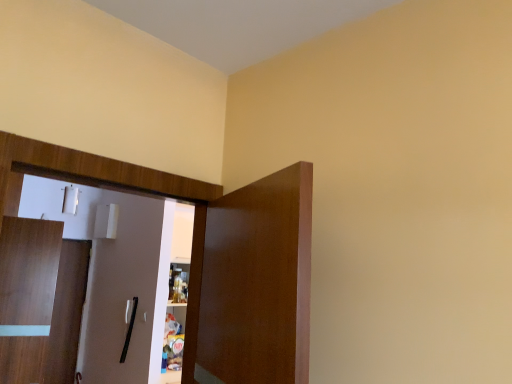
Question: Does wooden door at left, the 2th door when ordered from front to back, lie in front of wooden dresser at left?

Choices:
 (A) no
 (B) yes

Answer: (A)

Question: Can you confirm if wooden door at left, acting as the 1th door starting from the back, is shorter than wooden dresser at left?

Choices:
 (A) no
 (B) yes

Answer: (A)

Question: From a real-world perspective, is wooden door at left, which is the second door in right-to-left order, over wooden dresser at left?

Choices:
 (A) yes
 (B) no

Answer: (B)

Question: From the image's perspective, is wooden door at left, the 2th door when ordered from front to back, below wooden dresser at left?

Choices:
 (A) no
 (B) yes

Answer: (B)

Question: Is the position of wooden door at left, the 2th door when ordered from front to back, more distant than that of wooden dresser at left?

Choices:
 (A) no
 (B) yes

Answer: (B)

Question: Would you say brown wooden door at center, the 1th door viewed from the top, is to the left or to the right of wooden dresser at left in the picture?

Choices:
 (A) right
 (B) left

Answer: (A)

Question: Considering the positions of brown wooden door at center, which is counted as the second door, starting from the back, and wooden dresser at left in the image, is brown wooden door at center, which is counted as the second door, starting from the back, taller or shorter than wooden dresser at left?

Choices:
 (A) tall
 (B) short

Answer: (B)

Question: From a real-world perspective, is brown wooden door at center, acting as the 2th door starting from the left, physically located above or below wooden dresser at left?

Choices:
 (A) below
 (B) above

Answer: (A)

Question: In terms of width, does brown wooden door at center, the first door viewed from the right, look wider or thinner when compared to wooden dresser at left?

Choices:
 (A) wide
 (B) thin

Answer: (A)

Question: Choose the correct answer: Is wooden door at left, which ranks as the 1th door in left-to-right order, inside brown wooden door at center, the first door positioned from the front, or outside it?

Choices:
 (A) inside
 (B) outside

Answer: (B)

Question: Considering the positions of wooden door at left, the 2th door when ordered from front to back, and brown wooden door at center, positioned as the 2th door in bottom-to-top order, in the image, is wooden door at left, the 2th door when ordered from front to back, taller or shorter than brown wooden door at center, positioned as the 2th door in bottom-to-top order,?

Choices:
 (A) short
 (B) tall

Answer: (B)

Question: Considering the positions of wooden door at left, the 2th door when ordered from front to back, and brown wooden door at center, positioned as the 2th door in bottom-to-top order, in the image, is wooden door at left, the 2th door when ordered from front to back, bigger or smaller than brown wooden door at center, positioned as the 2th door in bottom-to-top order,?

Choices:
 (A) small
 (B) big

Answer: (A)

Question: From a real-world perspective, is wooden door at left, acting as the first door starting from the bottom, physically located above or below brown wooden door at center, positioned as the 2th door in bottom-to-top order?

Choices:
 (A) below
 (B) above

Answer: (A)

Question: From the image's perspective, is wooden door at left, acting as the first door starting from the bottom, above or below wooden dresser at left?

Choices:
 (A) above
 (B) below

Answer: (B)

Question: Considering the positions of point (67, 284) and point (296, 235), is point (67, 284) closer or farther from the camera than point (296, 235)?

Choices:
 (A) farther
 (B) closer

Answer: (A)